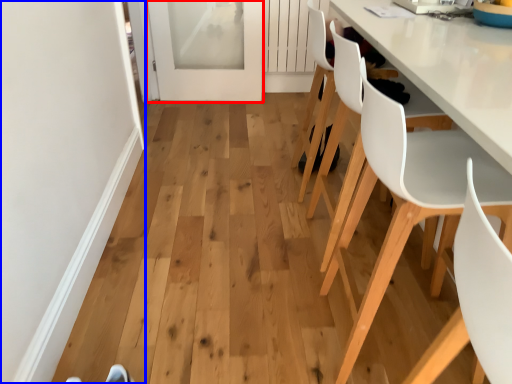
Question: Among these objects, which one is nearest to the camera, screen door (highlighted by a red box) or door (highlighted by a blue box)?

Choices:
 (A) screen door
 (B) door

Answer: (B)